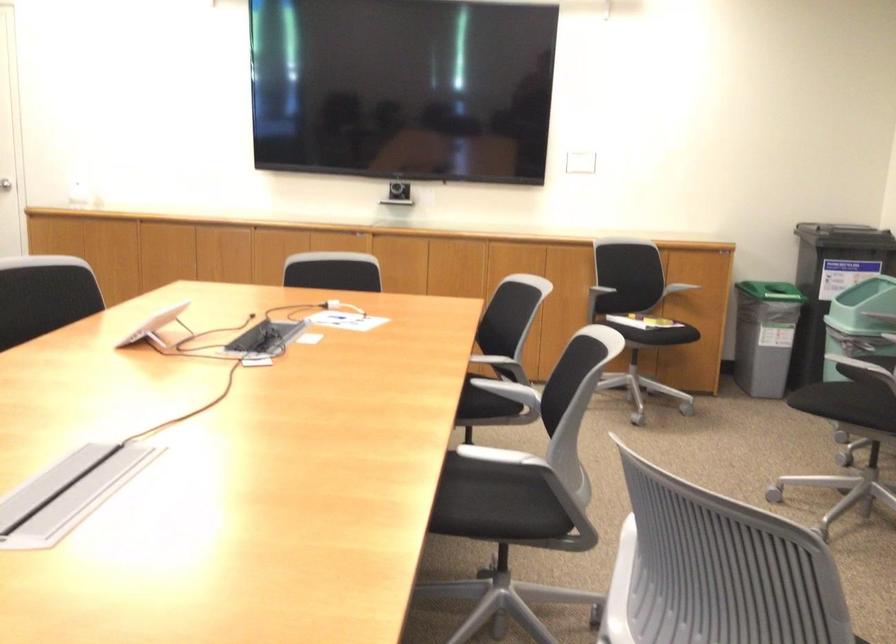
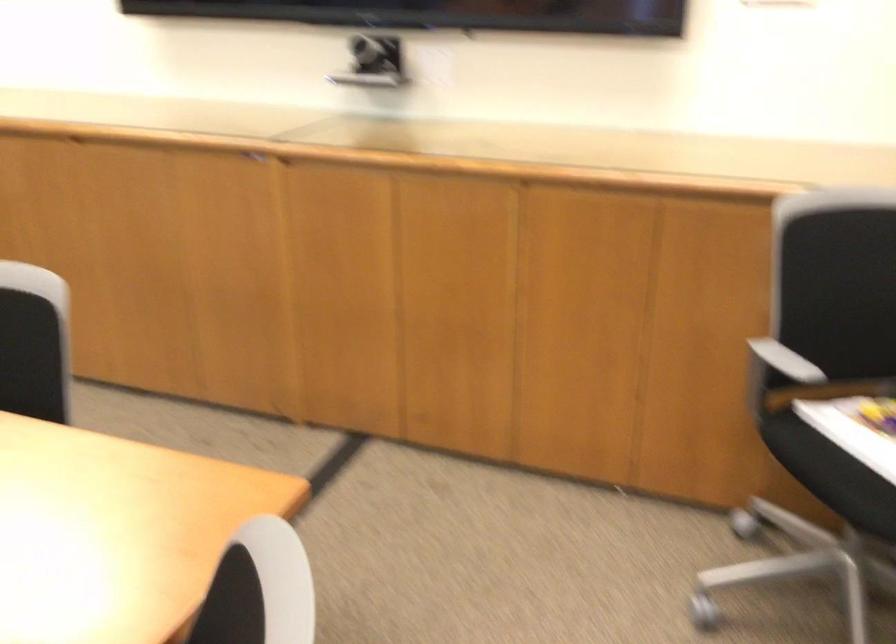
Where in the second image is the point corresponding to the point at 599,276 from the first image?

(778, 374)